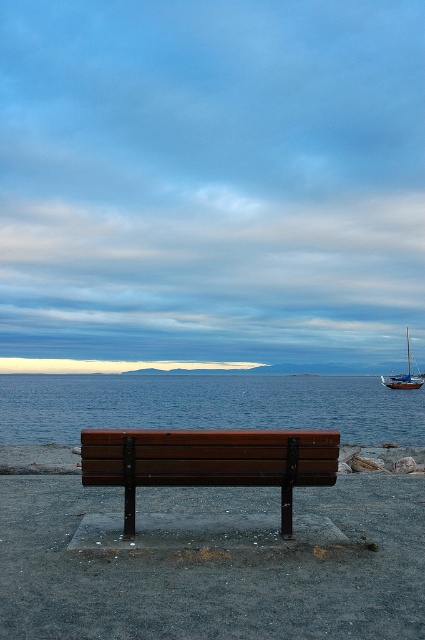
Is point (374, 440) farther from viewer compared to point (184, 442)?

Yes, point (374, 440) is farther from viewer.

Who is higher up, blue water at center or brown wooden bench at center?

brown wooden bench at center

You are a GUI agent. You are given a task and a screenshot of the screen. Output one action in this format:
    pyautogui.click(x=<x>, y=<y>)
    Task: Click on the blue water at center
    Image resolution: width=425 pixels, height=640 pixels.
    Given the screenshot: What is the action you would take?
    [206, 404]

I want to click on blue water at center, so click(x=206, y=404).

Who is shorter, blue water at center or brown wood bench at lower center?

Standing shorter between the two is blue water at center.

Is blue water at center wider than brown wood bench at lower center?

Yes, blue water at center is wider than brown wood bench at lower center.

Where is `blue water at center`? blue water at center is located at coordinates (206, 404).

You are a GUI agent. You are given a task and a screenshot of the screen. Output one action in this format:
    pyautogui.click(x=<x>, y=<y>)
    Task: Click on the blue water at center
    
    Given the screenshot: What is the action you would take?
    pyautogui.click(x=206, y=404)

Is brown wooden bench at center positioned in front of brown wood bench at lower center?

Yes, brown wooden bench at center is closer to the viewer.

Between brown wooden bench at center and brown wood bench at lower center, which one appears on the right side from the viewer's perspective?

Positioned to the right is brown wooden bench at center.

Which is in front, point (215, 476) or point (343, 451)?

Positioned in front is point (215, 476).

Where is `brown wooden bench at center`? The image size is (425, 640). brown wooden bench at center is located at coordinates (209, 461).